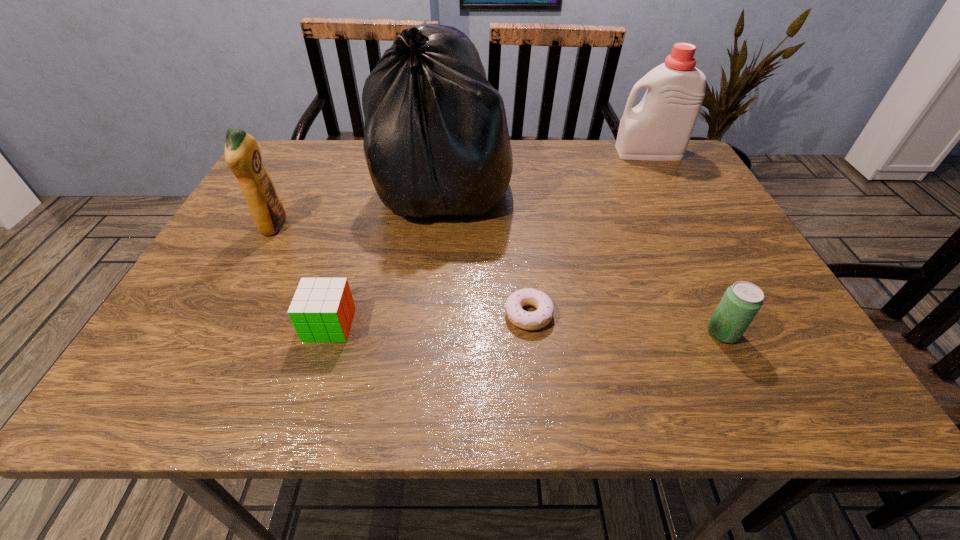
Locate an element on the screen. the tallest object is located at coordinates (436, 142).

You are a GUI agent. You are given a task and a screenshot of the screen. Output one action in this format:
    pyautogui.click(x=<x>, y=<y>)
    Task: Click on the farther detergent
    
    Given the screenshot: What is the action you would take?
    pos(659,128)

The height and width of the screenshot is (540, 960). Find the location of `the shorter detergent`. the shorter detergent is located at coordinates coord(242,154).

Identify the location of the leftmost object. (242, 154).

Locate an element on the screen. the third shortest object is located at coordinates (741, 302).

Identify the location of cube. (322, 309).

I want to click on doughnut, so click(538, 319).

Where is `free region located 0.080m on the left of the tallest object`? The image size is (960, 540). free region located 0.080m on the left of the tallest object is located at coordinates (348, 184).

You are a GUI agent. You are given a task and a screenshot of the screen. Output one action in this format:
    pyautogui.click(x=<x>, y=<y>)
    Task: Click on the vacant space situated on the handle side of the right detergent
    
    Given the screenshot: What is the action you would take?
    pyautogui.click(x=507, y=152)

At what (x,y) coordinates should I click in order to perform the action: click on blank area located on the handle side of the right detergent. Please return your answer as a coordinate pair (x, y). Image resolution: width=960 pixels, height=540 pixels. Looking at the image, I should click on (536, 152).